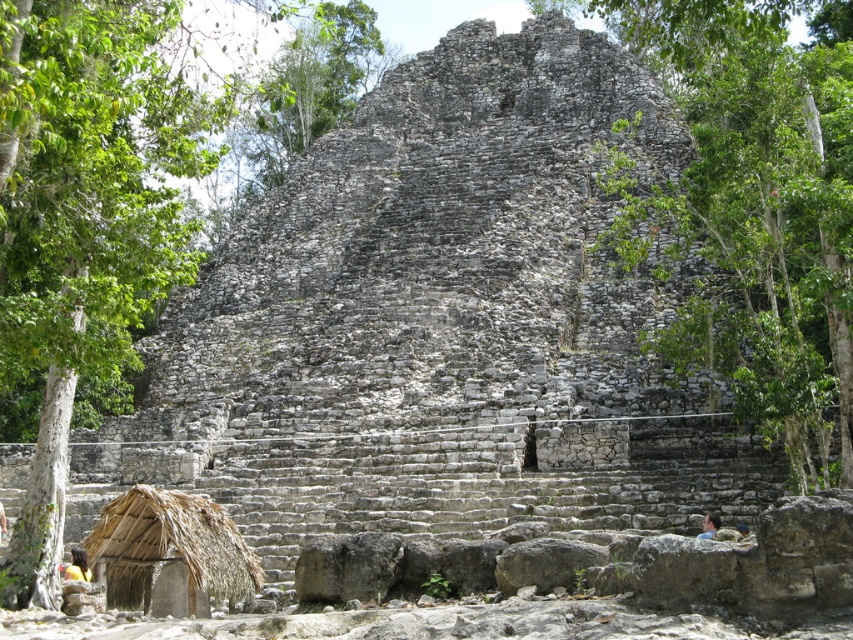
You are a visitor standing near the brown thatch hut at lower left and want to take a photo of the green leafy tree at center. Will the tree appear larger in the photo compared to the hut?

The green leafy tree at center is bigger than the brown thatch hut at lower left, so yes, the tree will appear larger in the photo than the hut.